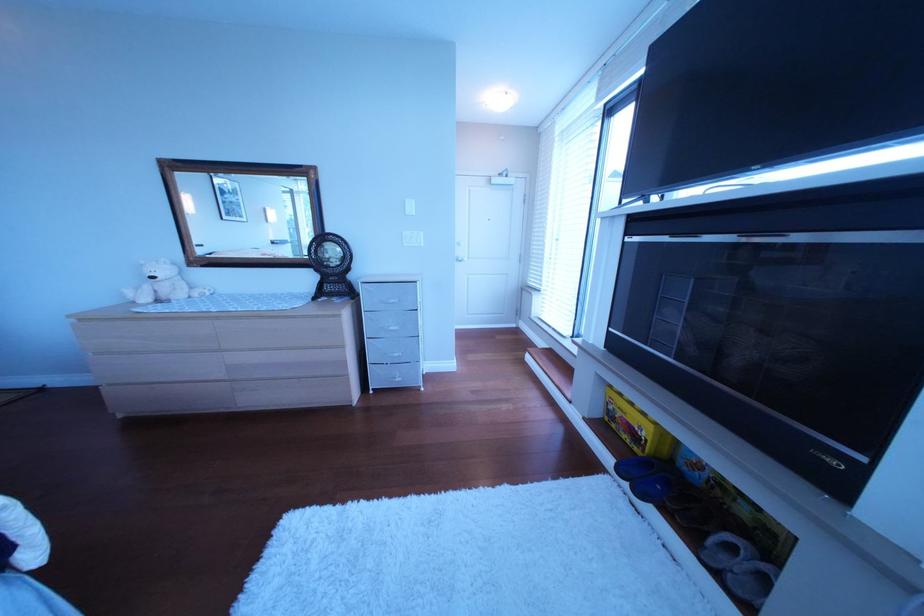
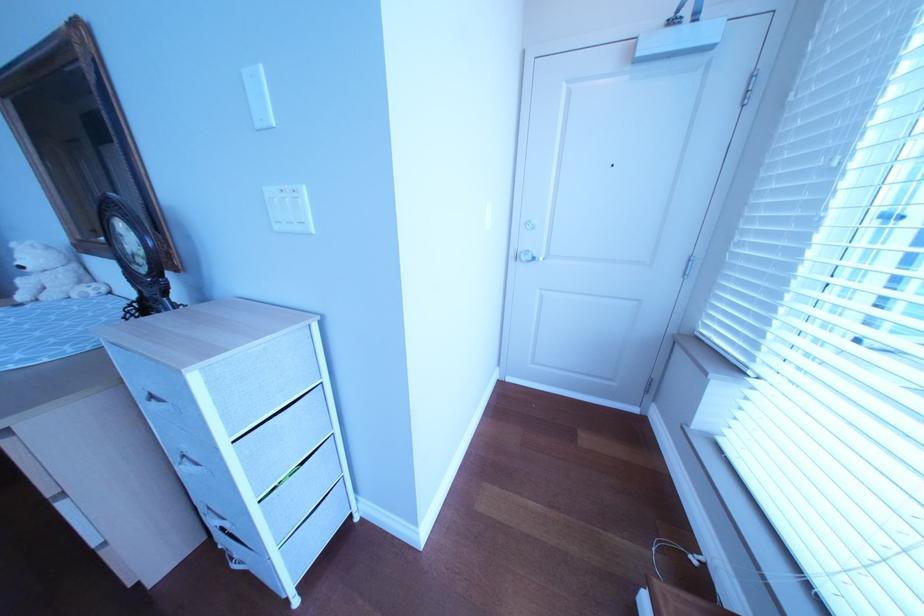
The point at (420, 246) is marked in the first image. Where is the corresponding point in the second image?

(292, 229)